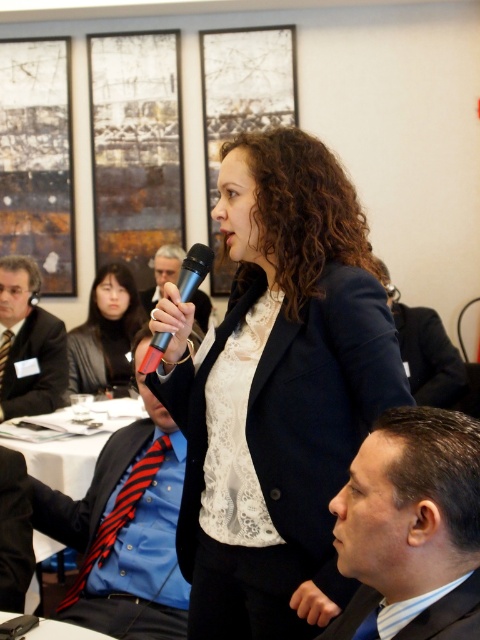
Who is shorter, dark blue suit at center or black tie at left?

With less height is dark blue suit at center.

In order to click on dark blue suit at center in this screenshot , I will do pos(408,509).

Find the location of a particular element. The width and height of the screenshot is (480, 640). dark blue suit at center is located at coordinates (408, 509).

Is point (10, 289) more distant than point (437, 380)?

Yes, it is behind point (437, 380).

Does black tie at left lie in front of black smooth suit at lower right?

Yes, black tie at left is in front of black smooth suit at lower right.

Does point (51, 410) lie in front of point (444, 369)?

Yes.

Identify the location of black tie at left. This screenshot has height=640, width=480. (27, 342).

Does dark blue suit at center have a lesser width compared to black leather jacket at upper left?

Correct, dark blue suit at center's width is less than black leather jacket at upper left's.

Which is behind, point (396, 468) or point (70, 346)?

Point (70, 346)

Locate an element on the screen. dark blue suit at center is located at coordinates (408, 509).